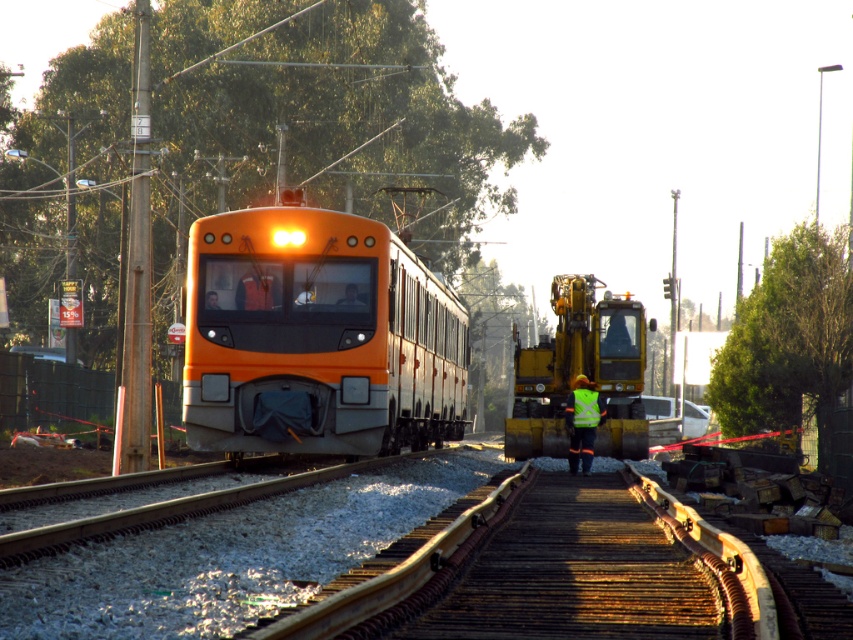
Can you confirm if orange matte train at center is smaller than high visibility yellow vest at center?

No.

Between orange matte train at center and high visibility yellow vest at center, which one is positioned higher?

orange matte train at center is above.

Between point (421, 419) and point (572, 435), which one is positioned behind?

The point (421, 419) is more distant.

Where is `orange matte train at center`? This screenshot has height=640, width=853. orange matte train at center is located at coordinates (317, 337).